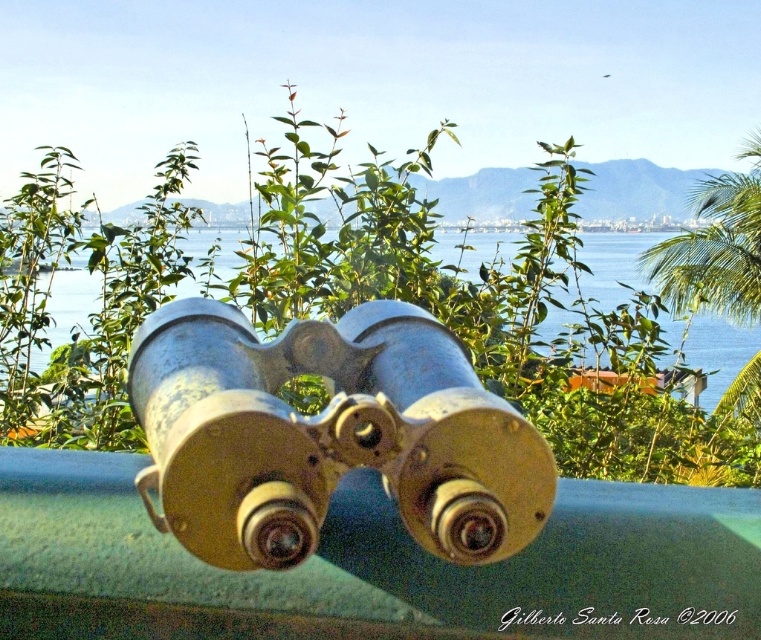
Question: Which point is farther to the camera?

Choices:
 (A) gold metallic binoculars at center
 (B) green leafy palm tree at upper right

Answer: (B)

Question: Can you confirm if gold metallic binoculars at center is positioned to the left of metallic water at center?

Choices:
 (A) yes
 (B) no

Answer: (A)

Question: Is green leafy palm tree at upper right bigger than metallic water at center?

Choices:
 (A) no
 (B) yes

Answer: (B)

Question: Among these points, which one is nearest to the camera?

Choices:
 (A) (465, 257)
 (B) (131, 362)
 (C) (734, 234)

Answer: (B)

Question: Which object is closer to the camera taking this photo?

Choices:
 (A) gold metallic binoculars at center
 (B) metallic water at center

Answer: (A)

Question: From the image, what is the correct spatial relationship of gold metallic binoculars at center in relation to metallic water at center?

Choices:
 (A) left
 (B) right

Answer: (A)